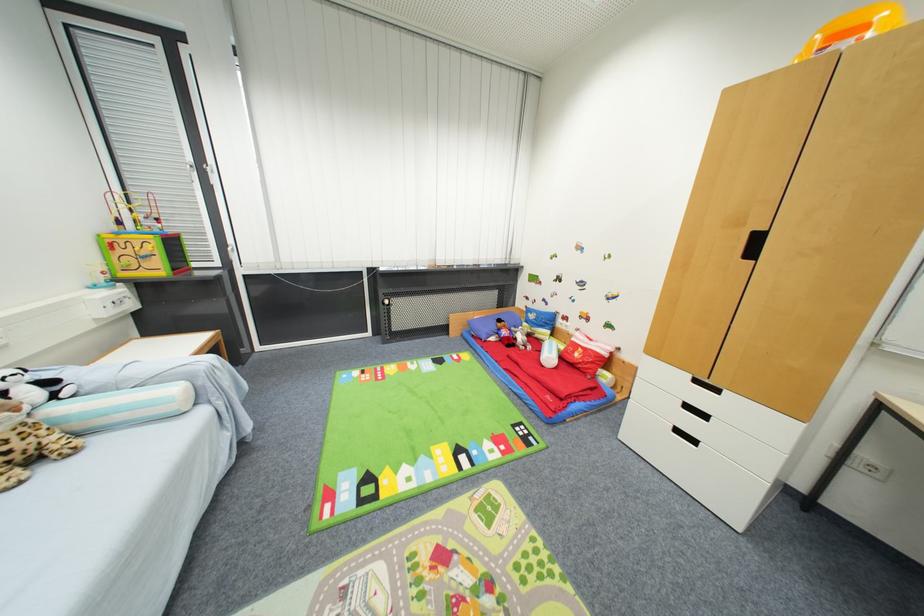
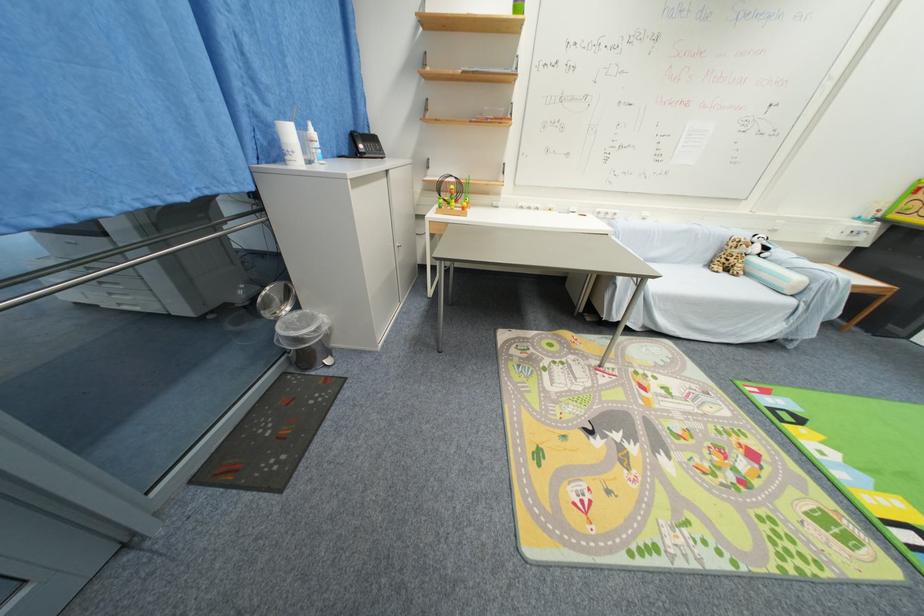
The point at (52,471) is marked in the first image. Where is the corresponding point in the second image?

(730, 276)